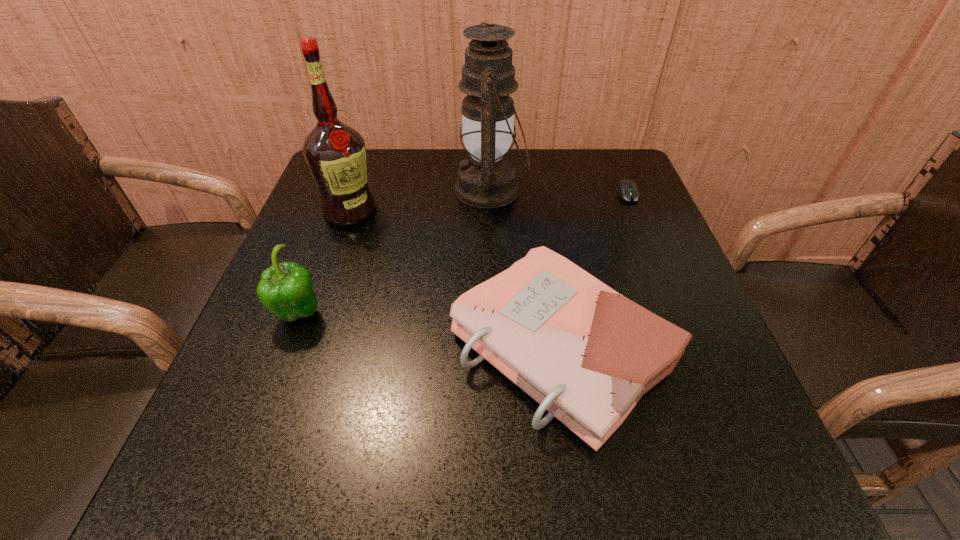
Image resolution: width=960 pixels, height=540 pixels. Find the location of `oil lamp`. oil lamp is located at coordinates (486, 180).

I want to click on alcohol, so click(x=335, y=153).

The height and width of the screenshot is (540, 960). I want to click on bell pepper, so click(x=285, y=289).

Find the location of `phonebook`. phonebook is located at coordinates (587, 354).

The height and width of the screenshot is (540, 960). Find the location of `computer mouse`. computer mouse is located at coordinates (627, 189).

Locate an element on the screen. This screenshot has width=960, height=540. free space located 0.320m on the left of the oil lamp is located at coordinates (326, 190).

Image resolution: width=960 pixels, height=540 pixels. Find the location of `vacant space located 0.160m on the label of the alcohol`. vacant space located 0.160m on the label of the alcohol is located at coordinates (327, 278).

Image resolution: width=960 pixels, height=540 pixels. Find the location of `vacant space located on the right of the bell pepper`. vacant space located on the right of the bell pepper is located at coordinates (485, 315).

Find the location of a particular element. The height and width of the screenshot is (540, 960). vacant space situated 0.290m on the left of the phonebook is located at coordinates (283, 347).

Locate an element on the screen. This screenshot has width=960, height=540. vacant space located on the wheel side of the computer mouse is located at coordinates (681, 324).